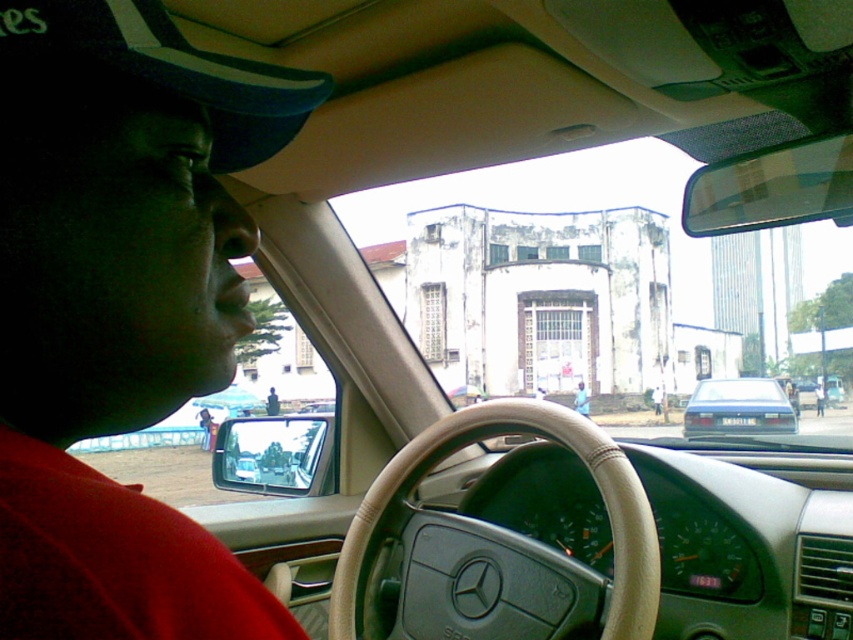
Question: Which point is closer to the camera?

Choices:
 (A) light blue fabric shirt at center
 (B) matte black sedan at center

Answer: (B)

Question: Which point appears closest to the camera in this image?

Choices:
 (A) (582, 396)
 (B) (747, 385)
 (C) (30, 51)

Answer: (C)

Question: Does dark blue fabric baseball cap at upper left appear under light blue fabric shirt at center?

Choices:
 (A) yes
 (B) no

Answer: (B)

Question: Where is dark blue fabric baseball cap at upper left located in relation to matte black sedan at center in the image?

Choices:
 (A) left
 (B) right

Answer: (A)

Question: Estimate the real-world distances between objects in this image. Which object is farther from the matte black shirt at left?

Choices:
 (A) dark blue fabric baseball cap at upper left
 (B) light blue fabric shirt at center

Answer: (A)

Question: Observing the image, what is the correct spatial positioning of light blue fabric shirt at center in reference to matte black shirt at left?

Choices:
 (A) below
 (B) above

Answer: (B)